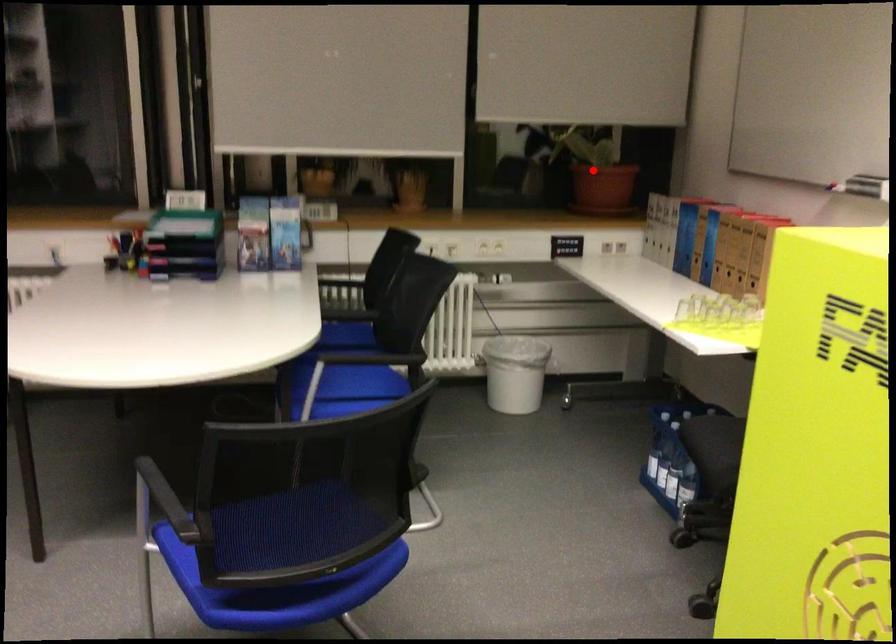
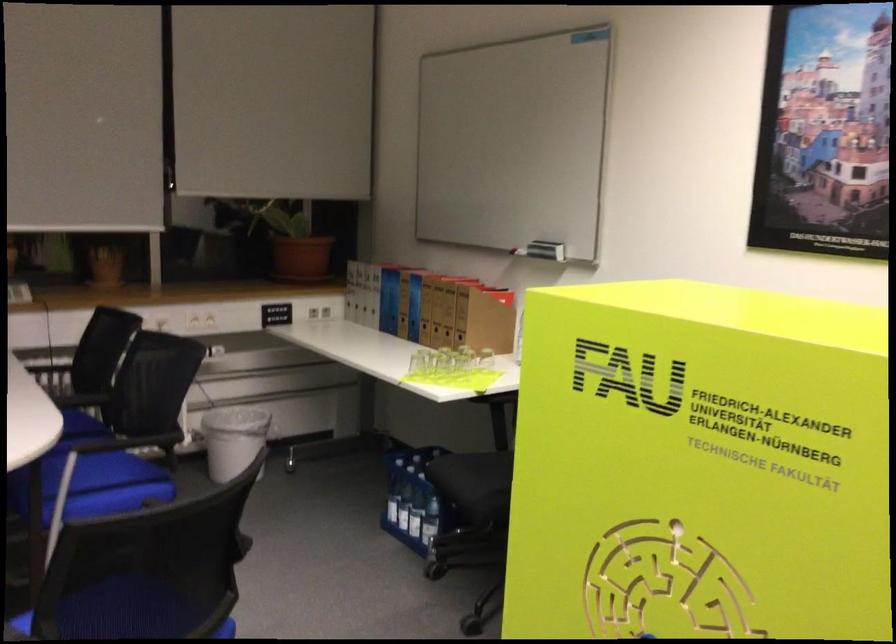
Question: I am providing you with two images of the same scene from different viewpoints. A red point is marked on the first image. Is the red point's position out of view in image 2?

Choices:
 (A) Yes
 (B) No

Answer: (B)